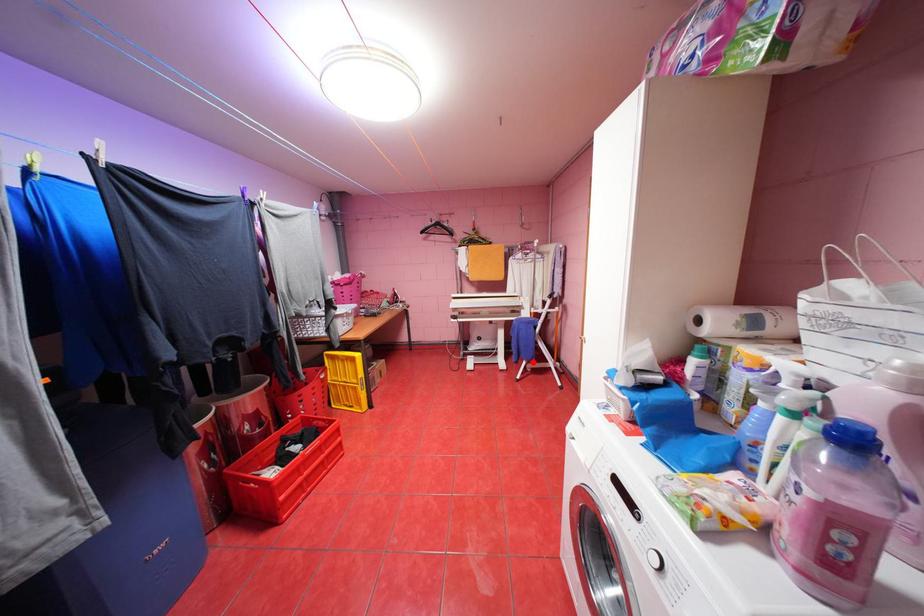
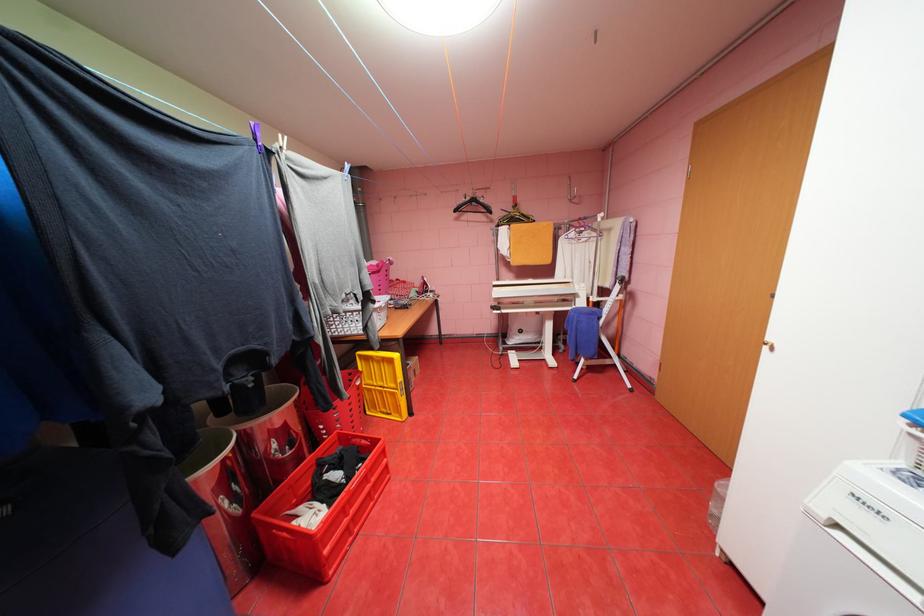
The point at the highlighted location is marked in the first image. Where is the corresponding point in the second image?

(591, 360)